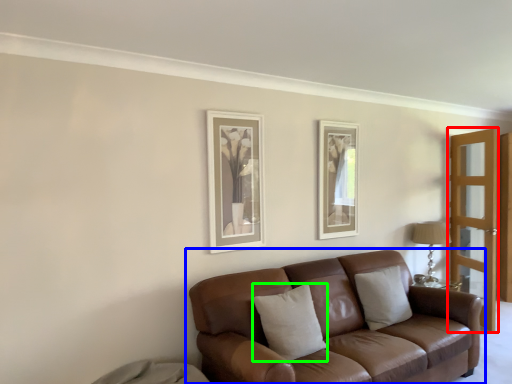
Question: Which object is the closest to the screen door (highlighted by a red box)? Choose among these: studio couch (highlighted by a blue box) or pillow (highlighted by a green box).

Choices:
 (A) studio couch
 (B) pillow

Answer: (A)